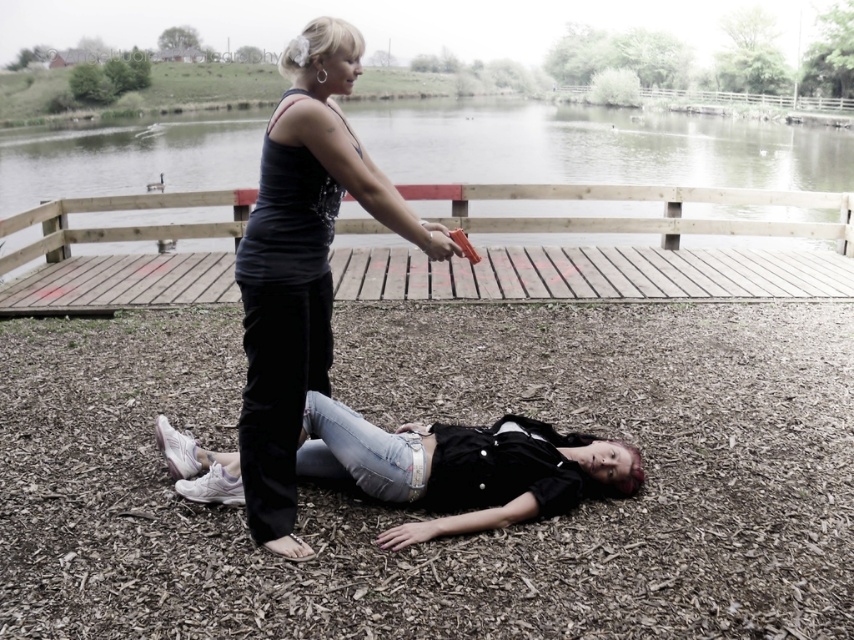
Question: Is clear water at dock center bigger than denim jeans at lower center?

Choices:
 (A) no
 (B) yes

Answer: (B)

Question: Can you confirm if wooden dock at center is bigger than clear water at dock center?

Choices:
 (A) yes
 (B) no

Answer: (B)

Question: Which object is farther from the camera taking this photo?

Choices:
 (A) clear water at dock center
 (B) wooden dock at center
 (C) matte black tank top at center
 (D) denim jeans at lower center

Answer: (B)

Question: Which point is farther to the camera?

Choices:
 (A) (765, 282)
 (B) (145, 145)
 (C) (334, 36)
 (D) (583, 467)

Answer: (B)

Question: Can you confirm if matte black tank top at center is bigger than denim jeans at lower center?

Choices:
 (A) no
 (B) yes

Answer: (B)

Question: Which object is positioned farthest from the wooden dock at center?

Choices:
 (A) clear water at dock center
 (B) denim jeans at lower center

Answer: (A)